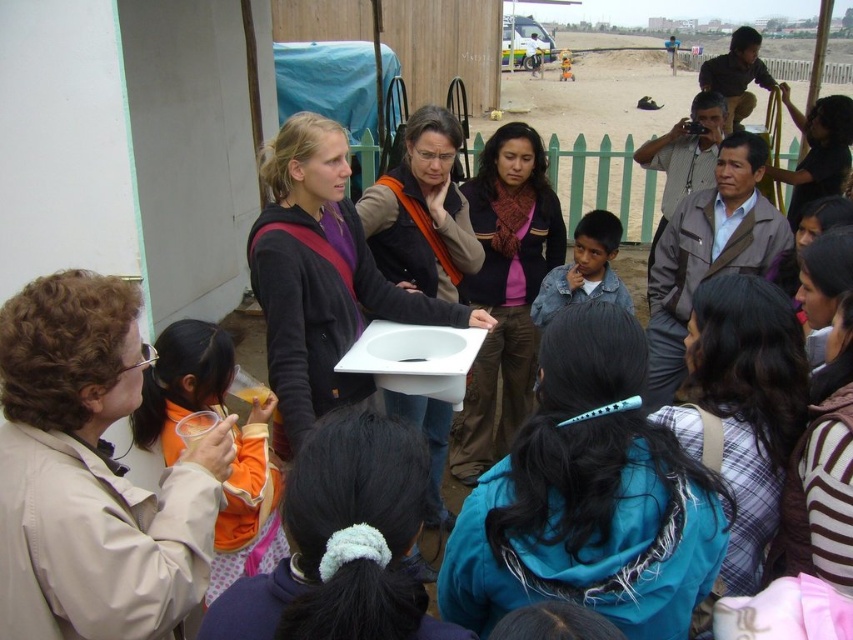
Who is positioned more to the right, matte black sink at center or denim jacket at center?

Positioned to the right is denim jacket at center.

Is matte black sink at center above denim jacket at center?

No, matte black sink at center is not above denim jacket at center.

Between point (289, 132) and point (567, 300), which one is positioned in front?

Positioned in front is point (289, 132).

Identify the location of matte black sink at center. (321, 278).

Is beige fabric jacket at lower left behind plaid fabric shirt at center?

No, beige fabric jacket at lower left is in front of plaid fabric shirt at center.

Which is above, beige fabric jacket at lower left or plaid fabric shirt at center?

Positioned higher is plaid fabric shirt at center.

Image resolution: width=853 pixels, height=640 pixels. Identify the location of beige fabric jacket at lower left. (90, 474).

Find the location of `beige fabric jacket at lower left`. beige fabric jacket at lower left is located at coordinates (90, 474).

Is beige fabric jacket at lower left positioned behind orange fabric shirt at left?

That is False.

Find the location of `beige fabric jacket at lower left`. beige fabric jacket at lower left is located at coordinates (90, 474).